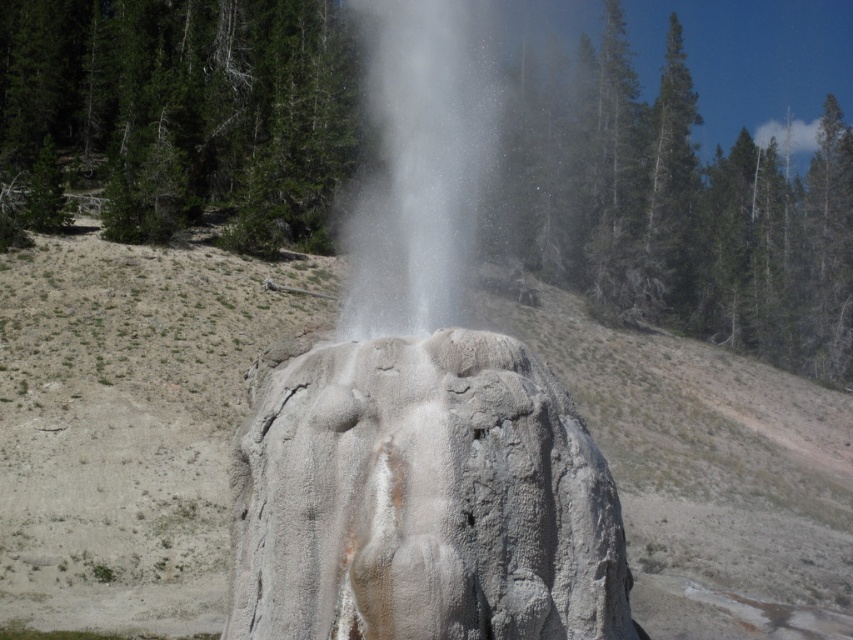
Based on the photo, you are a geologist standing at the edge of a forest, observing the gray rock formation at center. If your safety equipment can withstand being within 40 feet of an active geyser, is it safe for you to remain at your current position?

The gray rock formation at center is 39.48 feet away from you, which is within the 40 feet safety limit of your equipment. Therefore, it is safe for you to remain at your current position.